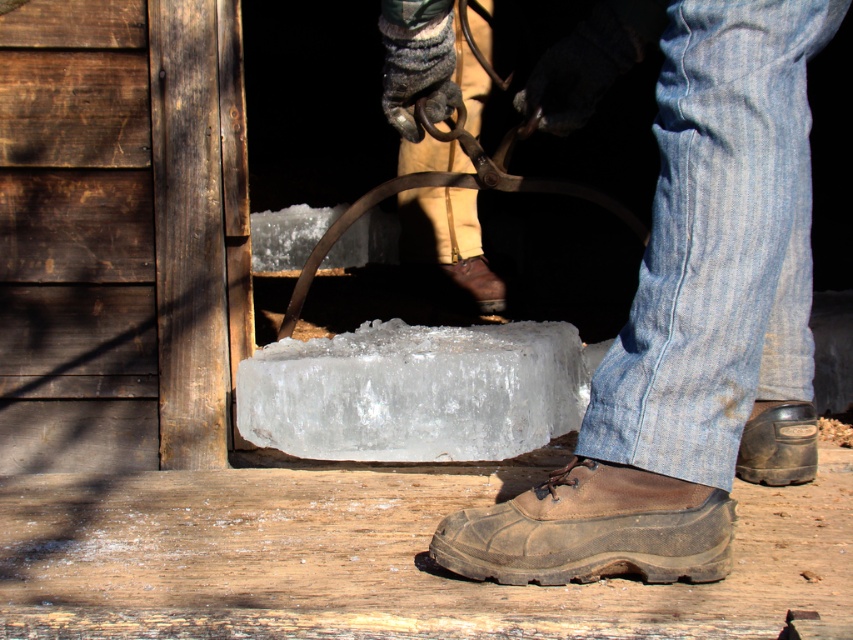
You are a delivery person trying to place a box on the ground between the brown suede shoe at lower center and the brown leather shoe at center. Can you fit the box there if the box is 10 cm wide?

The brown suede shoe at lower center might be wider than brown leather shoe at center, so there might not be enough space between them to fit a 10 cm wide box.

You are standing in front of the ice block and want to reach the point at coordinates [601,508] on the ice block. If your arm can reach 1.2 meters, can you touch that point?

The point at coordinates [601,508] is 1.31 meters away from the viewer, which is beyond your arm reach of 1.2 meters. You cannot touch it.